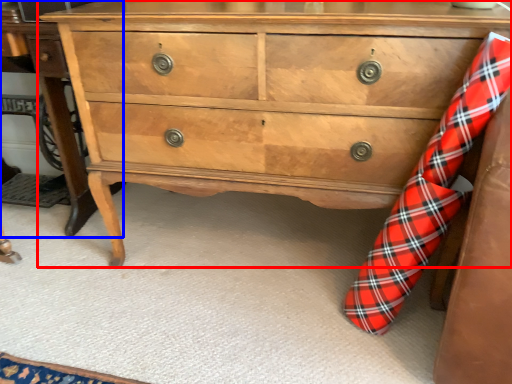
Question: Which of the following is the closest to the observer, chest of drawers (highlighted by a red box) or table (highlighted by a blue box)?

Choices:
 (A) chest of drawers
 (B) table

Answer: (A)